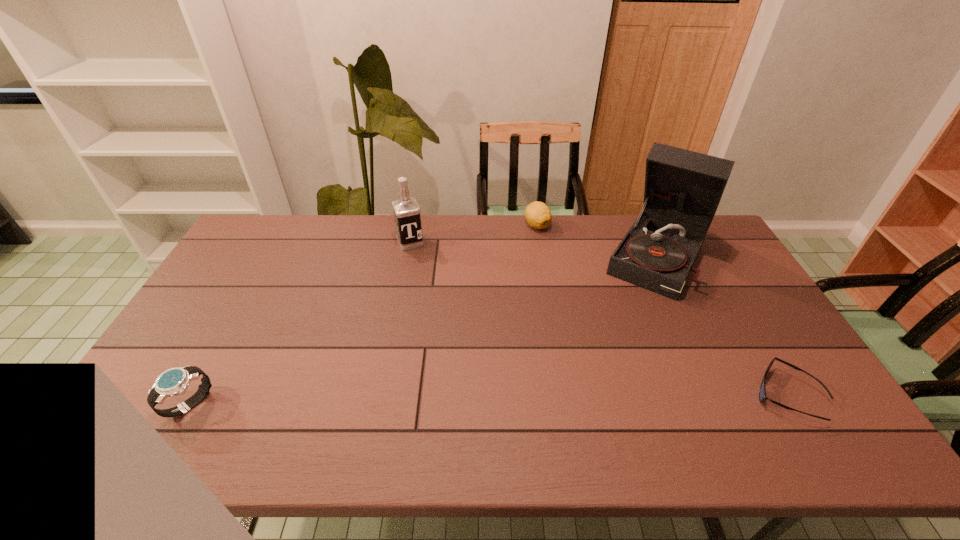
The image size is (960, 540). What are the coordinates of `the third tallest object` in the screenshot? It's located at (173, 382).

Locate an element on the screen. This screenshot has width=960, height=540. the leftmost object is located at coordinates (173, 382).

I want to click on the shortest object, so click(x=762, y=393).

Find the location of `lemon`. lemon is located at coordinates (538, 215).

Find the location of a particular element. This screenshot has width=960, height=540. the fourth tallest object is located at coordinates (538, 215).

Where is `vodka`? vodka is located at coordinates (406, 210).

This screenshot has width=960, height=540. I want to click on the second object from left to right, so click(x=406, y=210).

Where is `phonograph_record`? The image size is (960, 540). phonograph_record is located at coordinates (683, 188).

Identify the location of vacant region located 0.090m on the back of the watch. (217, 356).

Find the location of a particular element. The height and width of the screenshot is (540, 960). vacant point located at the front of the sunglasses showing the lenses is located at coordinates (704, 395).